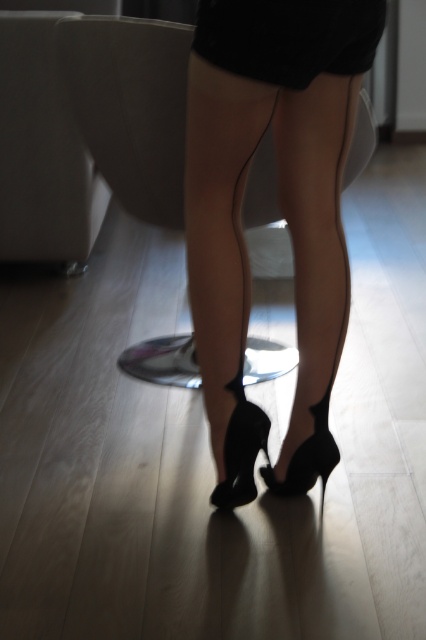
Question: Based on their relative distances, which object is nearer to the satin black stockings at center?

Choices:
 (A) black suede heels at center
 (B) black satin stockings at center
 (C) black matte dress at center

Answer: (A)

Question: Which point is farther to the camera?

Choices:
 (A) black satin stockings at center
 (B) black suede heels at center
 (C) satin black stockings at center
 (D) black matte dress at center

Answer: (A)

Question: Which object is closer to the camera taking this photo?

Choices:
 (A) black suede heels at center
 (B) satin black stockings at center
 (C) black leather high-heeled shoe at center
 (D) black satin stockings at center

Answer: (A)

Question: Is satin black stockings at center thinner than black satin stockings at center?

Choices:
 (A) no
 (B) yes

Answer: (B)

Question: Can you confirm if black suede heels at center is positioned below satin black stockings at center?

Choices:
 (A) yes
 (B) no

Answer: (B)

Question: Is black suede heels at center smaller than black satin stockings at center?

Choices:
 (A) no
 (B) yes

Answer: (A)